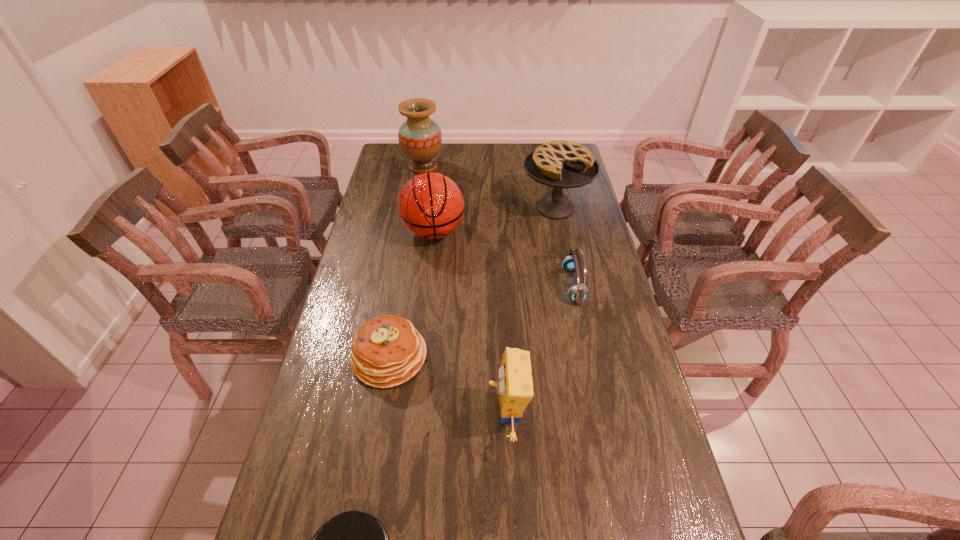
The height and width of the screenshot is (540, 960). Identify the location of the farthest object. (420, 138).

Identify the location of pie. (562, 164).

Find the location of a particular element. This screenshot has height=540, width=960. basketball is located at coordinates (430, 205).

This screenshot has height=540, width=960. In order to click on the fourth tallest object in this screenshot , I will do `click(515, 386)`.

Locate an element on the screen. The width and height of the screenshot is (960, 540). sponge is located at coordinates (515, 386).

This screenshot has width=960, height=540. What are the coordinates of `headset` in the screenshot? It's located at pos(574,262).

Find the location of a particular element. The width and height of the screenshot is (960, 540). the fifth tallest object is located at coordinates (574, 262).

Identify the location of the farther pancake. (387, 351).

Image resolution: width=960 pixels, height=540 pixels. In order to click on the taller pancake in this screenshot , I will do `click(387, 351)`.

The image size is (960, 540). Identify the location of free space located on the front of the farthest object. (418, 196).